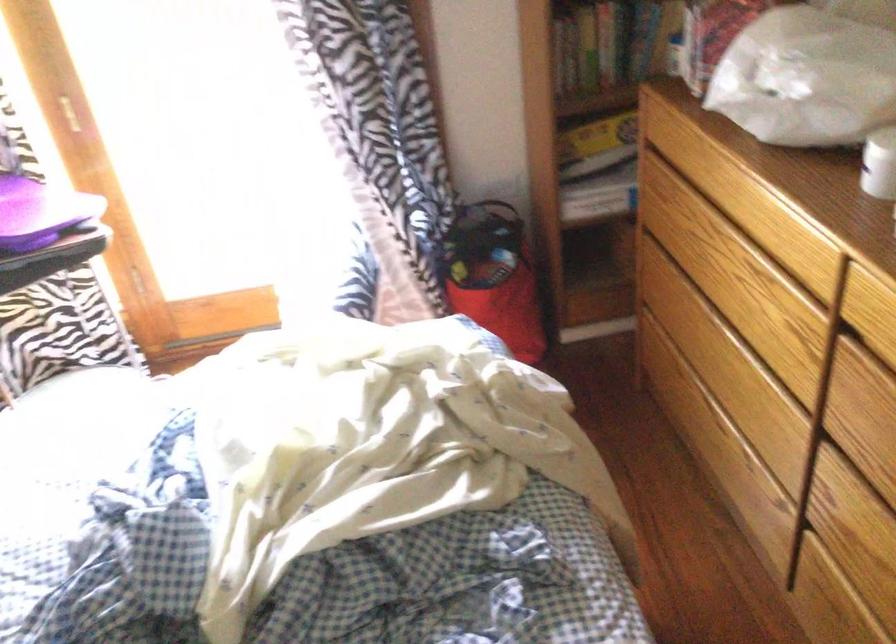
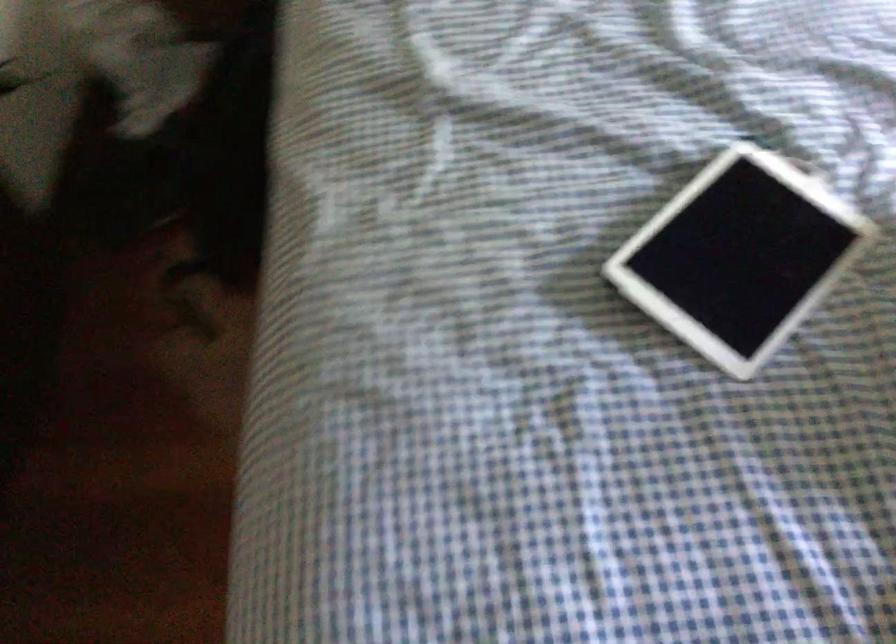
The images are taken continuously from a first-person perspective. In which direction is your viewpoint rotating?

The camera's rotation is toward left-down.